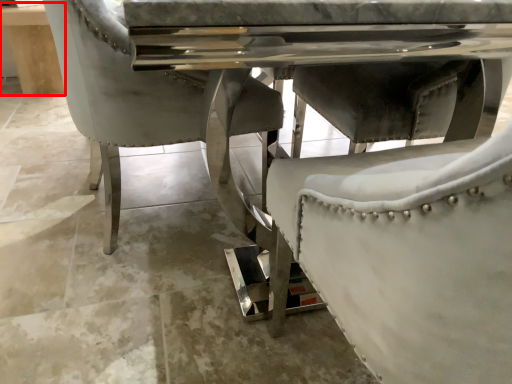
Question: Considering the relative positions of table (annotated by the red box) and concrete in the image provided, where is table (annotated by the red box) located with respect to the staircase?

Choices:
 (A) left
 (B) right

Answer: (A)